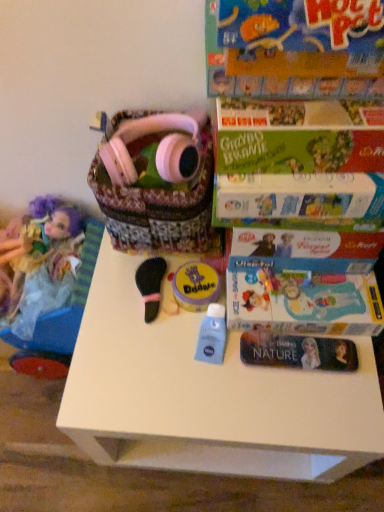
Question: Is green cardboard book at upper right, which appears as the 1th paperback book when viewed from the front, far from black felt brush at center, positioned as the second toy in right-to-left order?

Choices:
 (A) yes
 (B) no

Answer: (B)

Question: Can you confirm if green cardboard book at upper right, which appears as the 1th paperback book when viewed from the front, is shorter than black felt brush at center, positioned as the second toy in right-to-left order?

Choices:
 (A) no
 (B) yes

Answer: (A)

Question: From the image's perspective, would you say green cardboard book at upper right, acting as the 2th paperback book starting from the back, is positioned over black felt brush at center, which is the 1th toy in left-to-right order?

Choices:
 (A) no
 (B) yes

Answer: (B)

Question: Is green cardboard book at upper right, which appears as the 1th paperback book when viewed from the front, oriented away from black felt brush at center, which is the 1th toy in left-to-right order?

Choices:
 (A) no
 (B) yes

Answer: (A)

Question: Is green cardboard book at upper right, which appears as the 1th paperback book when viewed from the front, aimed at black felt brush at center, positioned as the second toy in right-to-left order?

Choices:
 (A) yes
 (B) no

Answer: (B)

Question: From a real-world perspective, is matte cardboard book at upper right, acting as the 2th paperback book starting from the front, above or below green cardboard book at upper right, which appears as the 1th paperback book when viewed from the front?

Choices:
 (A) below
 (B) above

Answer: (A)

Question: Do you think matte cardboard book at upper right, the 1th paperback book in the back-to-front sequence, is within green cardboard book at upper right, which appears as the 1th paperback book when viewed from the front, or outside of it?

Choices:
 (A) outside
 (B) inside

Answer: (A)

Question: In terms of width, does matte cardboard book at upper right, acting as the 2th paperback book starting from the front, look wider or thinner when compared to green cardboard book at upper right, which appears as the 1th paperback book when viewed from the front?

Choices:
 (A) thin
 (B) wide

Answer: (B)

Question: Is matte cardboard book at upper right, the 1th paperback book in the back-to-front sequence, taller or shorter than green cardboard book at upper right, acting as the 2th paperback book starting from the back?

Choices:
 (A) tall
 (B) short

Answer: (B)

Question: Is point (155, 179) closer or farther from the camera than point (44, 266)?

Choices:
 (A) farther
 (B) closer

Answer: (B)

Question: Based on their sizes in the image, would you say pink fabric basket at upper center is bigger or smaller than matte purple doll at left?

Choices:
 (A) small
 (B) big

Answer: (B)

Question: In terms of width, does pink fabric basket at upper center look wider or thinner when compared to matte purple doll at left?

Choices:
 (A) thin
 (B) wide

Answer: (B)

Question: Considering their positions, is pink fabric basket at upper center located in front of or behind matte purple doll at left?

Choices:
 (A) front
 (B) behind

Answer: (A)

Question: Is pink matte headphones at upper center wider or thinner than green cardboard book at upper right, which appears as the 1th paperback book when viewed from the front?

Choices:
 (A) thin
 (B) wide

Answer: (A)

Question: Visually, is pink matte headphones at upper center positioned to the left or to the right of green cardboard book at upper right, which appears as the 1th paperback book when viewed from the front?

Choices:
 (A) right
 (B) left

Answer: (B)